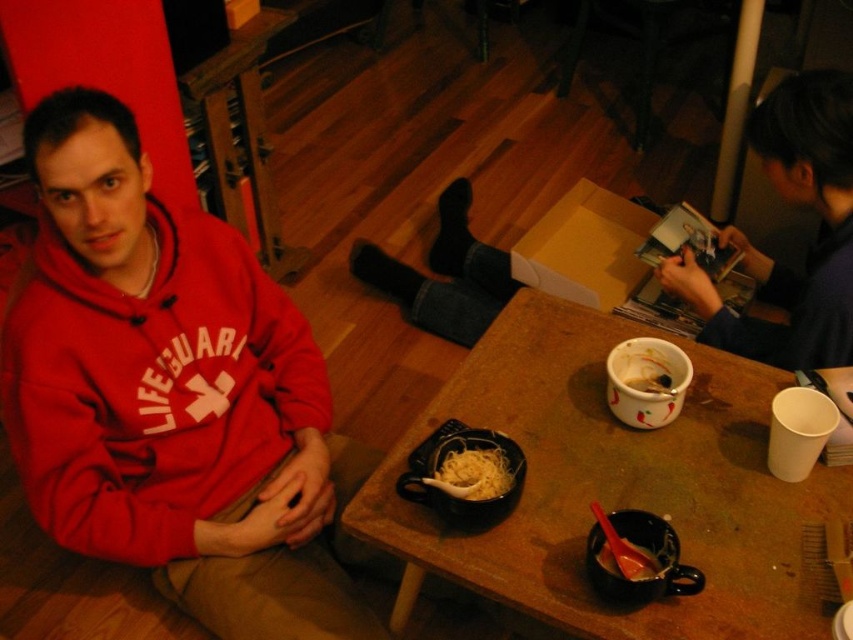
Who is positioned more to the right, matte red hoodie at left or smooth plastic spoon at lower center?

Positioned to the right is smooth plastic spoon at lower center.

Between point (265, 387) and point (621, 556), which one is positioned behind?

The point (265, 387) is more distant.

What do you see at coordinates (167, 392) in the screenshot? The height and width of the screenshot is (640, 853). I see `matte red hoodie at left` at bounding box center [167, 392].

Image resolution: width=853 pixels, height=640 pixels. Find the location of `matte red hoodie at left`. matte red hoodie at left is located at coordinates (167, 392).

Who is higher up, wooden table at center or dark blue fabric at upper right?

dark blue fabric at upper right

Can you confirm if wooden table at center is positioned to the right of dark blue fabric at upper right?

No, wooden table at center is not to the right of dark blue fabric at upper right.

The width and height of the screenshot is (853, 640). In order to click on wooden table at center in this screenshot , I will do `click(613, 486)`.

Image resolution: width=853 pixels, height=640 pixels. Find the location of `wooden table at center`. wooden table at center is located at coordinates (613, 486).

Is point (109, 513) farther from viewer compared to point (670, 358)?

Yes, point (109, 513) is farther from viewer.

Find the location of a particular element. The height and width of the screenshot is (640, 853). matte red hoodie at left is located at coordinates (167, 392).